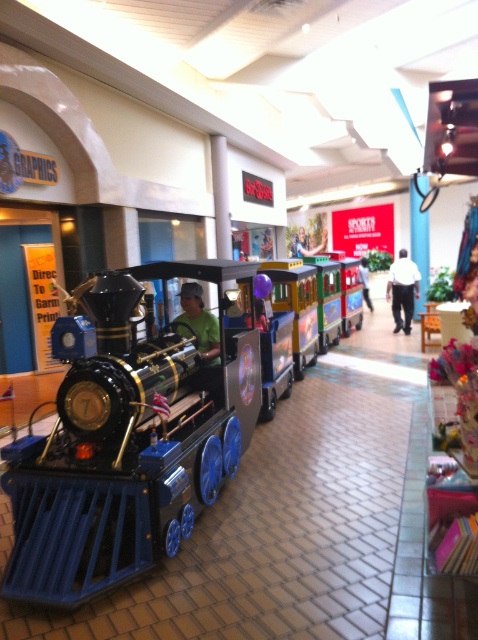
Question: Can you confirm if shiny black locomotive at left is thinner than white fabric pants at center?

Choices:
 (A) yes
 (B) no

Answer: (B)

Question: Which point is farther to the camera?

Choices:
 (A) (361, 282)
 (B) (119, 560)

Answer: (A)

Question: Among these objects, which one is farthest from the camera?

Choices:
 (A) shiny black locomotive at left
 (B) white fabric pants at center
 (C) matte green shirt at center

Answer: (C)

Question: Which object is farther from the camera taking this photo?

Choices:
 (A) shiny black locomotive at left
 (B) green fabric person at center
 (C) white fabric pants at center
 (D) green matte shirt at center

Answer: (B)

Question: Is green fabric person at center below matte green shirt at center?

Choices:
 (A) no
 (B) yes

Answer: (A)

Question: Is green matte shirt at center to the right of matte green shirt at center from the viewer's perspective?

Choices:
 (A) yes
 (B) no

Answer: (B)